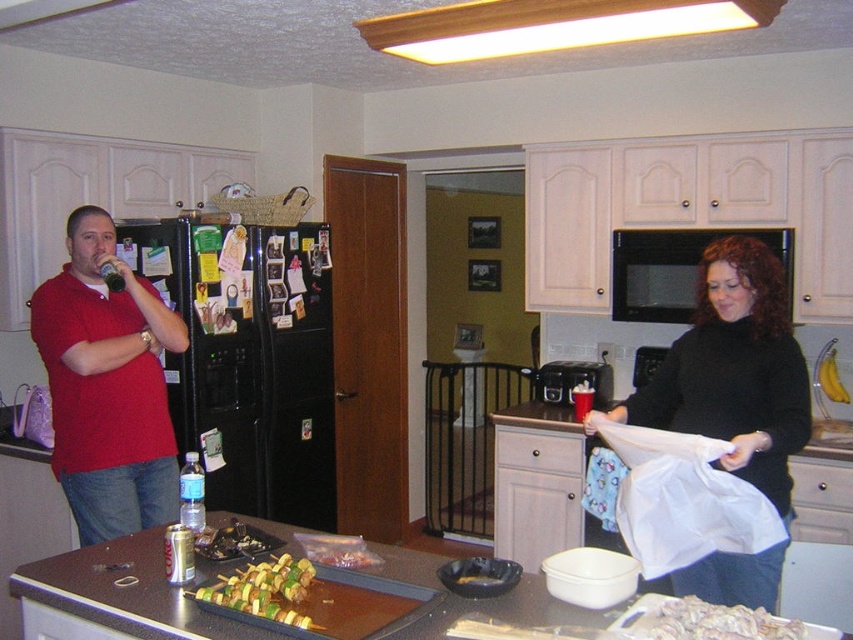
You are planning to install a new light fixture in the kitchen. The wooden frame fluorescent light at upper center and the white crumbly food at lower right are in your way. Which object is bigger and needs to be moved first?

The wooden frame fluorescent light at upper center is larger than the white crumbly food at lower right, so it needs to be moved first.